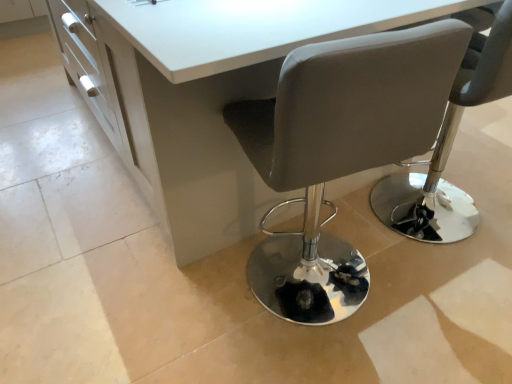
Question: Considering the relative positions of matte gray chair at center, marked as the first chair in a left-to-right arrangement, and white glossy table at center in the image provided, is matte gray chair at center, marked as the first chair in a left-to-right arrangement, in front of white glossy table at center?

Choices:
 (A) yes
 (B) no

Answer: (A)

Question: Is matte gray chair at center, marked as the first chair in a left-to-right arrangement, located outside white glossy table at center?

Choices:
 (A) no
 (B) yes

Answer: (A)

Question: Could you tell me if matte gray chair at center, which is the 2th chair in right-to-left order, is turned towards white glossy table at center?

Choices:
 (A) no
 (B) yes

Answer: (B)

Question: Is matte gray chair at center, which is the 2th chair in right-to-left order, at the right side of white glossy table at center?

Choices:
 (A) no
 (B) yes

Answer: (B)

Question: Is matte gray chair at center, marked as the first chair in a left-to-right arrangement, facing away from white glossy table at center?

Choices:
 (A) no
 (B) yes

Answer: (B)

Question: From their relative heights in the image, would you say white glossy table at center is taller or shorter than matte gray chair at center, which is the 2th chair in right-to-left order?

Choices:
 (A) short
 (B) tall

Answer: (A)

Question: Is white glossy table at center inside or outside of matte gray chair at center, which is the 2th chair in right-to-left order?

Choices:
 (A) inside
 (B) outside

Answer: (B)

Question: In terms of width, does white glossy table at center look wider or thinner when compared to matte gray chair at center, marked as the first chair in a left-to-right arrangement?

Choices:
 (A) thin
 (B) wide

Answer: (B)

Question: From the image's perspective, is white glossy table at center located above or below matte gray chair at center, which is the 2th chair in right-to-left order?

Choices:
 (A) below
 (B) above

Answer: (B)

Question: Is matte gray chair at center, which is the 2th chair in right-to-left order, taller or shorter than white glossy table at center?

Choices:
 (A) tall
 (B) short

Answer: (A)

Question: From a real-world perspective, relative to white glossy table at center, is matte gray chair at center, which is the 2th chair in right-to-left order, vertically above or below?

Choices:
 (A) above
 (B) below

Answer: (A)

Question: Based on their sizes in the image, would you say matte gray chair at center, which is the 2th chair in right-to-left order, is bigger or smaller than white glossy table at center?

Choices:
 (A) small
 (B) big

Answer: (A)

Question: Relative to white glossy table at center, is matte gray chair at center, marked as the first chair in a left-to-right arrangement, in front or behind?

Choices:
 (A) front
 (B) behind

Answer: (A)

Question: From the image's perspective, relative to matte gray chair at center, the second chair in the left-to-right sequence, is white glossy table at center above or below?

Choices:
 (A) below
 (B) above

Answer: (B)

Question: Is point (244, 172) positioned closer to the camera than point (466, 102)?

Choices:
 (A) closer
 (B) farther

Answer: (B)